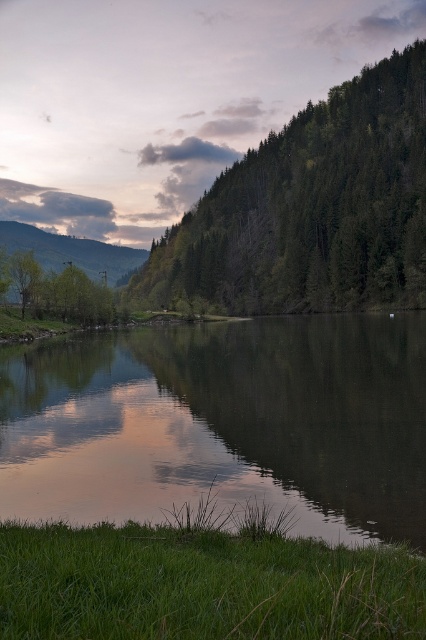
Question: Is the position of green matte tree at left more distant than that of green matte mountain at left?

Choices:
 (A) no
 (B) yes

Answer: (A)

Question: Among these points, which one is nearest to the camera?

Choices:
 (A) (337, 244)
 (B) (13, 275)
 (C) (118, 264)
 (D) (25, 468)

Answer: (D)

Question: Which point is closer to the camera taking this photo?

Choices:
 (A) (71, 314)
 (B) (9, 243)

Answer: (A)

Question: Does green textured forest at upper center have a larger size compared to green matte tree at left?

Choices:
 (A) yes
 (B) no

Answer: (A)

Question: Which point is closer to the camera?

Choices:
 (A) (112, 298)
 (B) (121, 404)
 (C) (49, 234)
 (D) (250, 243)

Answer: (B)

Question: In this image, where is smooth reflective water at center located relative to green textured forest at upper center?

Choices:
 (A) above
 (B) below

Answer: (B)